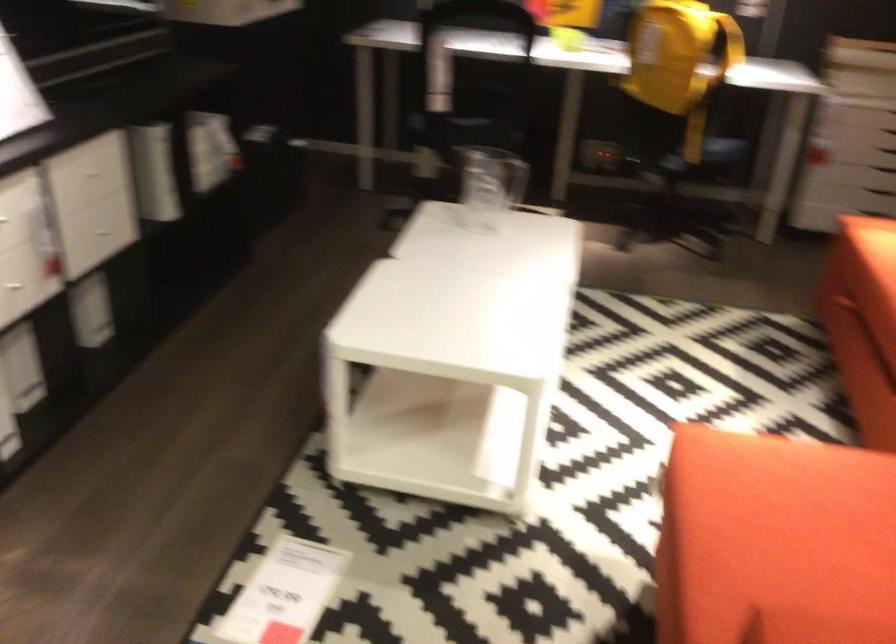
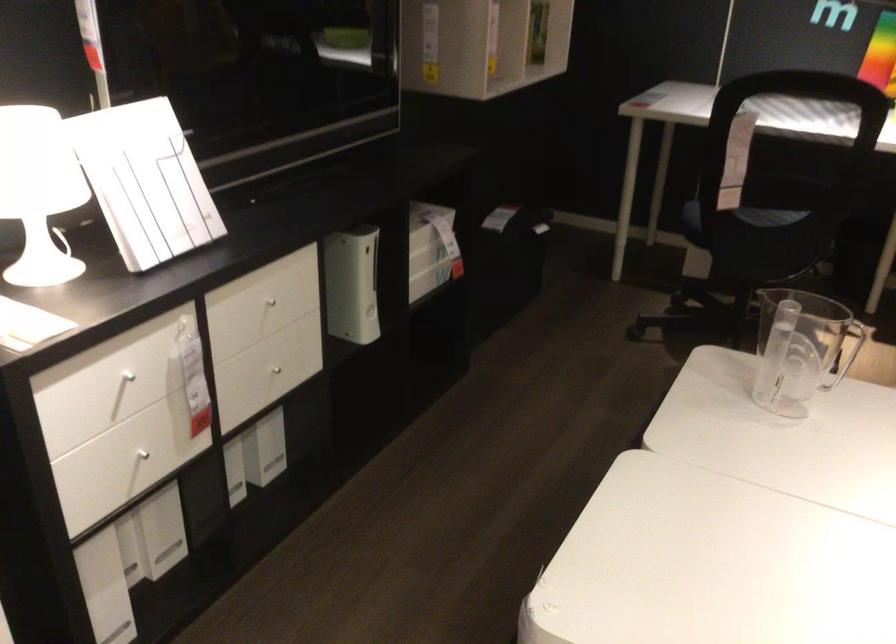
Question: The camera is either moving clockwise (left) or counter-clockwise (right) around the object. The first image is from the beginning of the video and the second image is from the end. Is the camera moving left or right when shooting the video?

Choices:
 (A) Left
 (B) Right

Answer: (B)